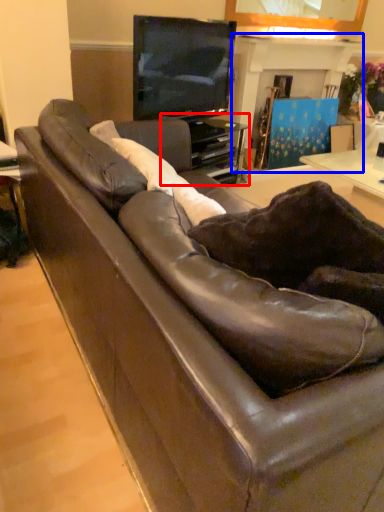
Question: Which of the following is the closest to the observer, entertainment center (highlighted by a red box) or fireplace (highlighted by a blue box)?

Choices:
 (A) entertainment center
 (B) fireplace

Answer: (A)